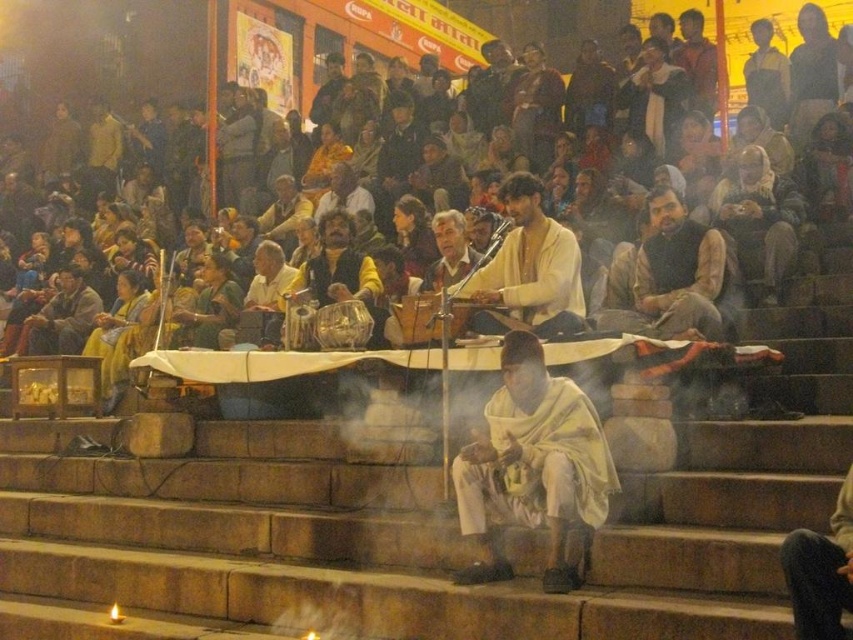
You are attending a nighttime cultural gathering and notice two items at the center of the scene. Which item is located to the right of the other? The items are the dark brown leather jacket at center and the light brown fabric at center.

The dark brown leather jacket at center is positioned on the right side of the light brown fabric at center.

You are an event photographer at the nighttime gathering. You need to capture a photo of both the dark brown leather jacket at center and the dark brown leather jacket at lower left. Which jacket should you focus on first to ensure both are in frame?

The dark brown leather jacket at center is much taller as dark brown leather jacket at lower left. So focus on the dark brown leather jacket at center first to ensure both are in frame.